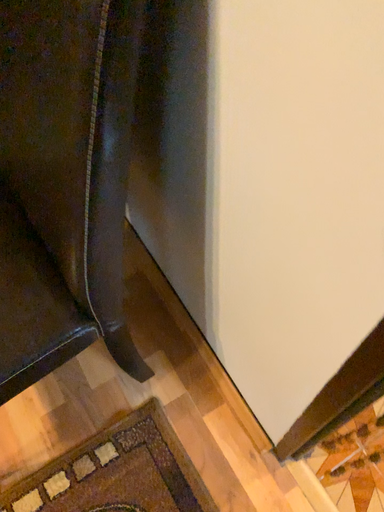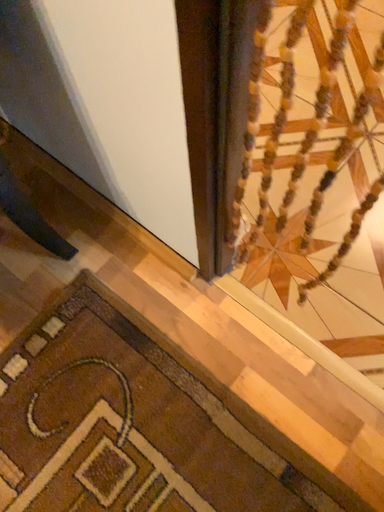
Question: Which way did the camera rotate in the video?

Choices:
 (A) rotated left
 (B) rotated right

Answer: (B)